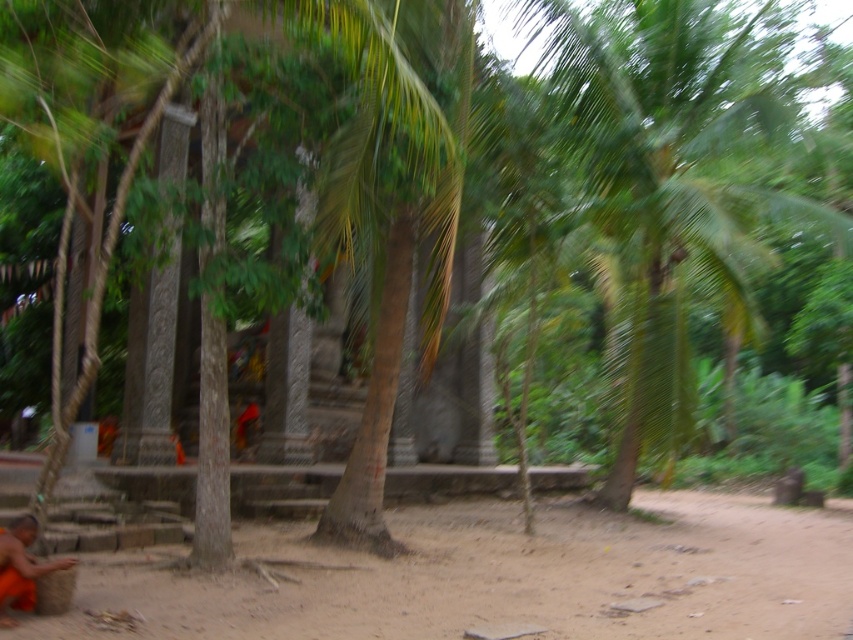
Question: Does brown sandy dirt at lower center appear under green leafy palm tree at right?

Choices:
 (A) yes
 (B) no

Answer: (A)

Question: Among these objects, which one is farthest from the camera?

Choices:
 (A) green leafy palm tree at right
 (B) brown sandy dirt at lower center
 (C) orange cloth at lower left

Answer: (A)

Question: Which object appears farthest from the camera in this image?

Choices:
 (A) orange cloth at lower left
 (B) brown sandy dirt at lower center
 (C) green leafy palm tree at right

Answer: (C)

Question: In this image, where is green leafy palm tree at right located relative to orange cloth at lower left?

Choices:
 (A) right
 (B) left

Answer: (A)

Question: Which point is farther to the camera?

Choices:
 (A) (21, 564)
 (B) (721, 509)
 (C) (622, 195)

Answer: (B)

Question: Is green leafy palm tree at right positioned behind orange cloth at lower left?

Choices:
 (A) yes
 (B) no

Answer: (A)